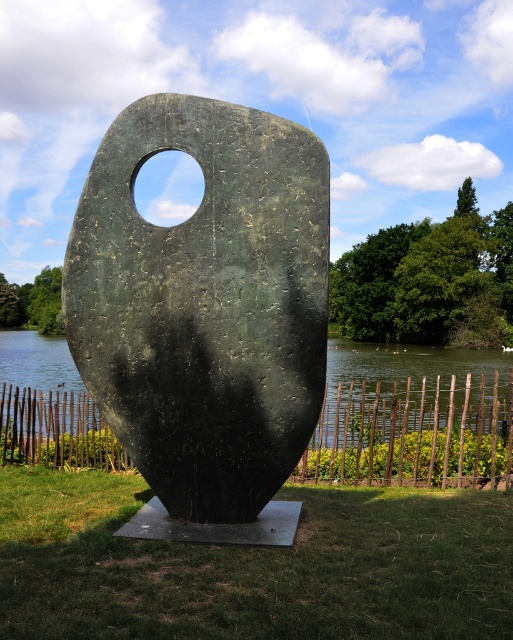
You are standing in the park and want to take a photo of the bronze textured stone at center and the green grass at center. Which object is closer to you when you point your camera towards them?

The bronze textured stone at center is closer to you than the green grass at center because it is positioned further to the viewer.